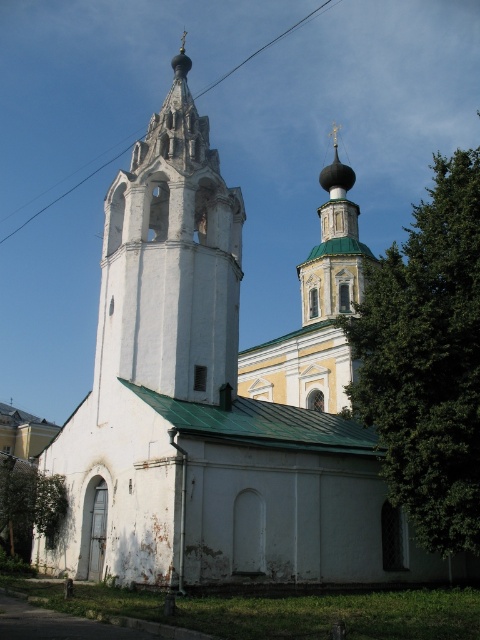
Between green wooden bell tower at upper center and green leafy tree at lower left, which one appears on the left side from the viewer's perspective?

From the viewer's perspective, green leafy tree at lower left appears more on the left side.

In the scene shown: Can you confirm if green wooden bell tower at upper center is bigger than green leafy tree at lower left?

Yes, green wooden bell tower at upper center is bigger than green leafy tree at lower left.

Does point (324, 305) come behind point (20, 525)?

Yes.

Identify the location of green wooden bell tower at upper center. Image resolution: width=480 pixels, height=640 pixels. (334, 248).

Does point (395, 474) come behind point (288, 29)?

No, (395, 474) is in front of (288, 29).

Is point (470, 481) positioned before point (320, 4)?

That is True.

Which is in front, point (432, 276) or point (44, 209)?

Positioned in front is point (432, 276).

Find the location of a particular element. The width and height of the screenshot is (480, 640). green leafy tree at upper right is located at coordinates (427, 358).

Is green leafy tree at upper right to the left of green leafy tree at lower left from the viewer's perspective?

In fact, green leafy tree at upper right is to the right of green leafy tree at lower left.

Is point (394, 451) more distant than point (27, 522)?

No, (394, 451) is closer to viewer.

You are a GUI agent. You are given a task and a screenshot of the screen. Output one action in this format:
    pyautogui.click(x=<x>, y=<y>)
    Task: Click on the green leafy tree at upper right
    The height and width of the screenshot is (640, 480).
    Given the screenshot: What is the action you would take?
    pyautogui.click(x=427, y=358)